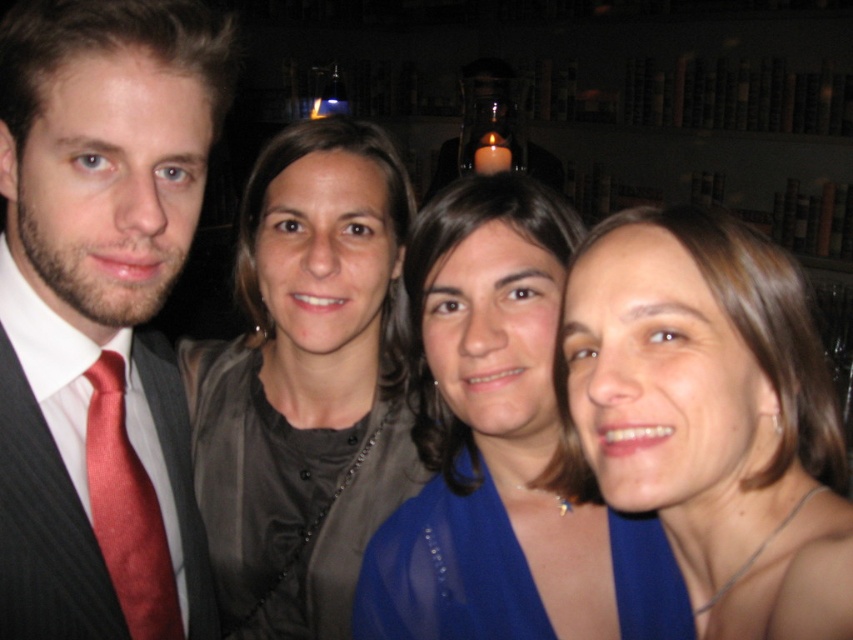
Describe the element at coordinates (448, 570) in the screenshot. I see `blue sheer dress at lower right` at that location.

Which is behind, point (425, 509) or point (109, 509)?

The point (425, 509) is behind.

This screenshot has width=853, height=640. In order to click on blue sheer dress at lower right in this screenshot , I will do `click(448, 570)`.

How distant is matte red tie at left from blue sheer dress at lower right?

The distance of matte red tie at left from blue sheer dress at lower right is 12.18 inches.

From the picture: Between matte red tie at left and blue sheer dress at lower right, which one has more height?

matte red tie at left

The height and width of the screenshot is (640, 853). In order to click on matte red tie at left in this screenshot , I will do `click(100, 314)`.

Who is shorter, matte blue dress at center or blue sheer dress at lower right?

With less height is blue sheer dress at lower right.

Does matte blue dress at center have a larger size compared to blue sheer dress at lower right?

Yes, matte blue dress at center is bigger than blue sheer dress at lower right.

Who is more forward, (x=769, y=529) or (x=657, y=634)?

Point (x=769, y=529)

You are a GUI agent. You are given a task and a screenshot of the screen. Output one action in this format:
    pyautogui.click(x=<x>, y=<y>)
    Task: Click on the matte blue dress at center
    This screenshot has width=853, height=640.
    Given the screenshot: What is the action you would take?
    click(711, 417)